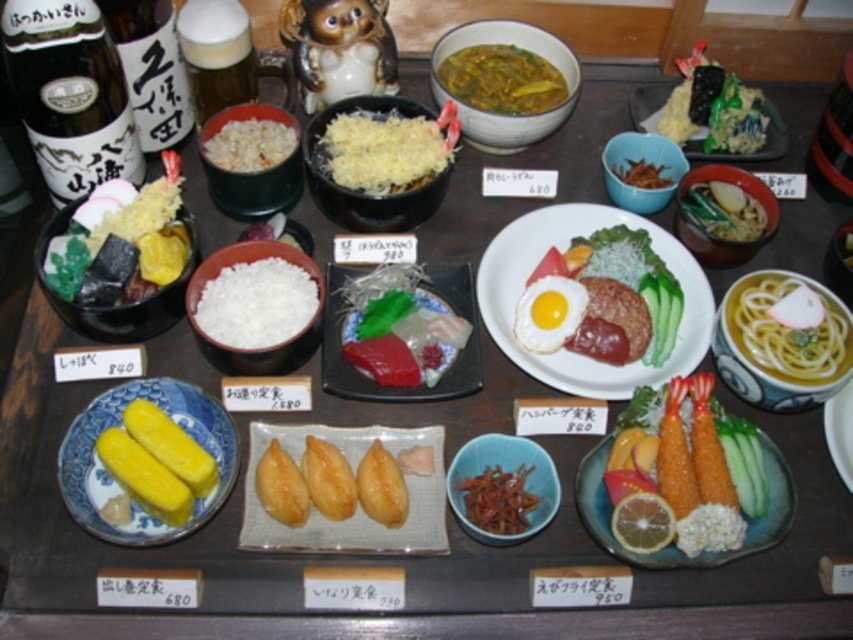
In the scene shown: Between translucent glass plate at center and green leafy vegetable at center, which one has more height?

translucent glass plate at center is taller.

Is translucent glass plate at center wider than green leafy vegetable at center?

Indeed, translucent glass plate at center has a greater width compared to green leafy vegetable at center.

Find the location of a particular element. This screenshot has height=640, width=853. translucent glass plate at center is located at coordinates (372, 380).

Measure the distance from green leafy vegetable at upper right to brown crispy fried at center.

green leafy vegetable at upper right and brown crispy fried at center are 26.85 inches apart.

Can you confirm if green leafy vegetable at upper right is shorter than brown crispy fried at center?

Incorrect, green leafy vegetable at upper right's height does not fall short of brown crispy fried at center's.

Identify the location of green leafy vegetable at upper right. The height and width of the screenshot is (640, 853). (714, 109).

Describe the element at coordinates (714, 109) in the screenshot. The image size is (853, 640). I see `green leafy vegetable at upper right` at that location.

Based on the photo, can you confirm if green leafy vegetable at upper right is smaller than yellow matte sushi at right?

No.

Is point (709, 96) in front of point (846, 392)?

No, (709, 96) is further to viewer.

Locate an element on the screen. This screenshot has width=853, height=640. green leafy vegetable at upper right is located at coordinates (714, 109).